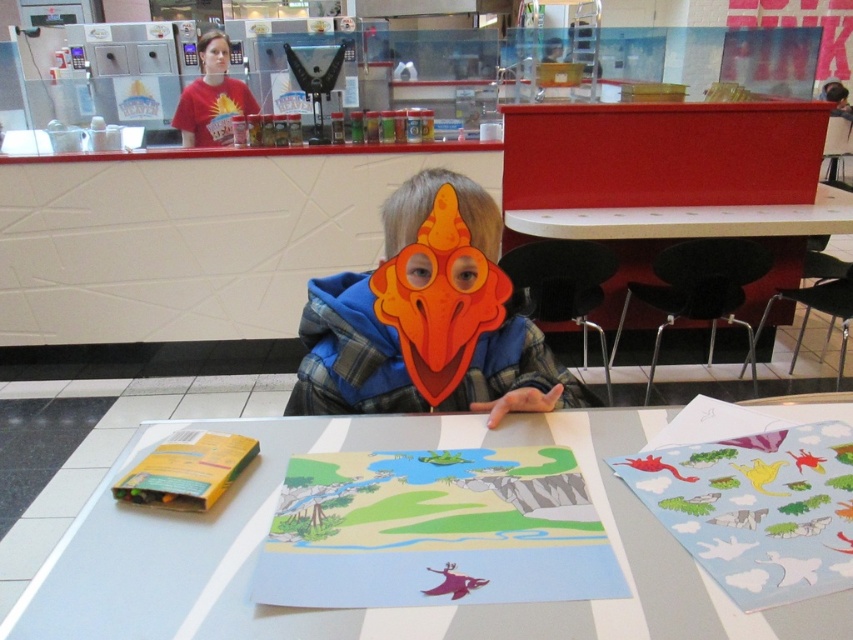
Does white glossy table at center appear under orange paper mask at center?

Yes.

Which is in front, point (225, 506) or point (390, 291)?

Point (225, 506) is more forward.

Image resolution: width=853 pixels, height=640 pixels. In order to click on white glossy table at center in this screenshot , I will do `click(399, 609)`.